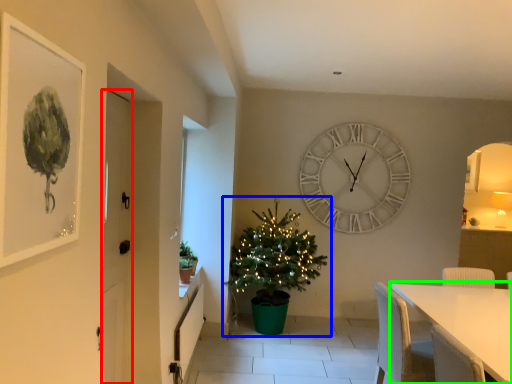
Question: Based on their relative distances, which object is farther from door (highlighted by a red box)? Choose from christmas tree (highlighted by a blue box) and table (highlighted by a green box).

Choices:
 (A) christmas tree
 (B) table

Answer: (A)